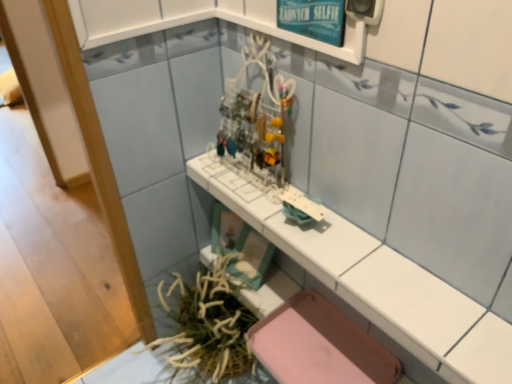
Question: From the image's perspective, relative to green leafy plant at lower left, is white glossy counter top at center above or below?

Choices:
 (A) below
 (B) above

Answer: (B)

Question: From a real-world perspective, is white glossy counter top at center above or below green leafy plant at lower left?

Choices:
 (A) above
 (B) below

Answer: (A)

Question: Which of these objects is positioned closest to the green leafy plant at lower left?

Choices:
 (A) teal glossy signboard at upper center
 (B) white glossy counter top at center

Answer: (B)

Question: Which object is positioned closest to the teal glossy signboard at upper center?

Choices:
 (A) white glossy counter top at center
 (B) green leafy plant at lower left

Answer: (A)